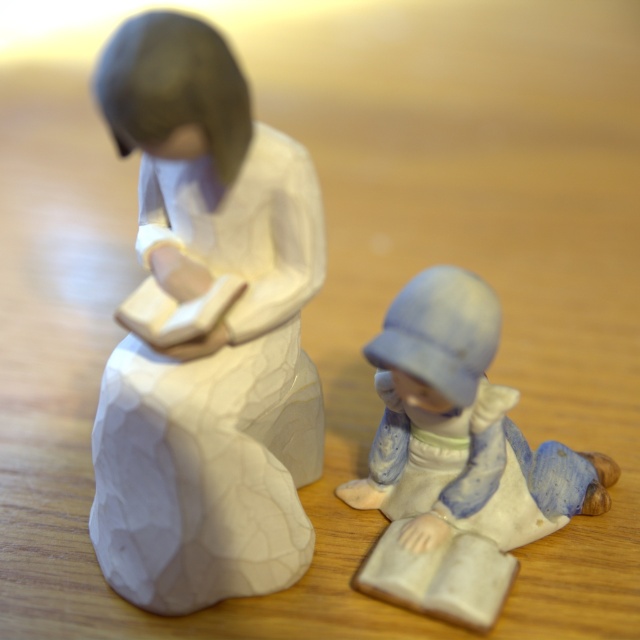
You are standing in front of the two ceramic figurines on the wooden surface. The adult figurine is on the left and the child is on the right. There is a point marked at coordinates (205, 333). Which figurine is this point located on?

The point at (205, 333) is on the white glossy statue at left, which is the adult figurine.

You are an art collector examining two figurines displayed on a shelf. The white glossy statue at left and the porcelain figure at lower right are both on the same shelf. If you want to place a new decorative item between them, which figurine has a narrower width to allow more space for the new item?

The white glossy statue at left is thinner than the porcelain figure at lower right, so placing the new decorative item between them would allow more space next to the white glossy statue at left.